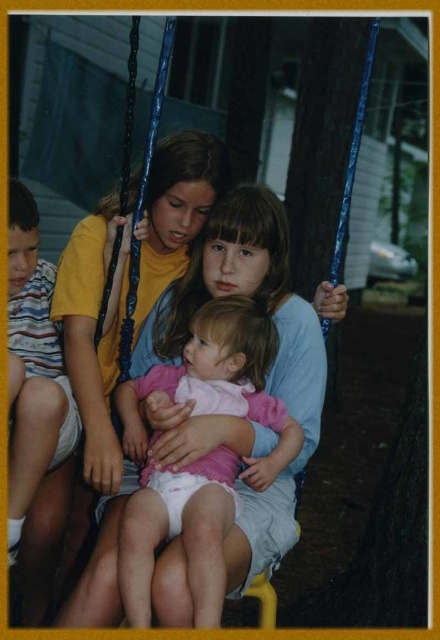
You are a photographer trying to capture a photo of the matte blue swing at center and the striped cotton shirt at left. Based on their positions, which object is closer to the camera?

The striped cotton shirt at left is closer to the camera because it is positioned above the matte blue swing at center, indicating it is in a forward plane.

You are standing in the park and see the matte blue swing at center. If you want to reach it quickly, how many steps do you think it would take you?

The matte blue swing at center is 4.06 feet away from viewer. Assuming an average step length of about 2.5 feet, you would need approximately 2 steps to reach the matte blue swing at center.

You are a photographer trying to capture the baby in the pink dress at center. You notice a point at coordinates (223, 380). Is this point located on the baby?

Yes, the point (223, 380) is on the matte pink dress at center, which is the baby.